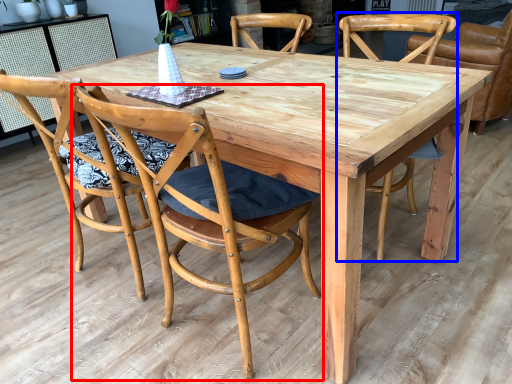
Question: Which object is closer to the camera taking this photo, chair (highlighted by a red box) or chair (highlighted by a blue box)?

Choices:
 (A) chair
 (B) chair

Answer: (A)